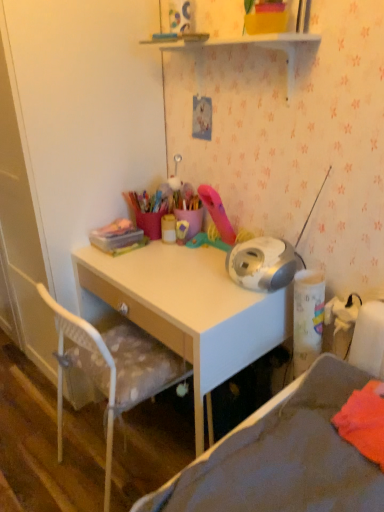
This screenshot has height=512, width=384. What do you see at coordinates (112, 369) in the screenshot?
I see `white mesh chair at lower left` at bounding box center [112, 369].

Where is `translucent plastic container at upper left, which appears as the 2th stationery when viewed from the right`? This screenshot has width=384, height=512. translucent plastic container at upper left, which appears as the 2th stationery when viewed from the right is located at coordinates pos(118,237).

What do you see at coordinates (282, 456) in the screenshot? I see `gray fabric bed at lower right` at bounding box center [282, 456].

Measure the distance between light wood desk at center and camera.

light wood desk at center is 1.15 meters away from camera.

Locate an element on the screen. The width and height of the screenshot is (384, 512). white mesh chair at lower left is located at coordinates (112, 369).

Does gray fabric bed at lower right appear on the right side of white mesh chair at lower left?

Yes.

Is gray fabric bed at lower right outside of white mesh chair at lower left?

Yes, gray fabric bed at lower right is outside of white mesh chair at lower left.

Where is `bed on the right of white mesh chair at lower left`? Image resolution: width=384 pixels, height=512 pixels. bed on the right of white mesh chair at lower left is located at coordinates (282, 456).

Consider the image. Who is bigger, gray fabric bed at lower right or white mesh chair at lower left?

white mesh chair at lower left.

Which is closer to the camera, (223, 42) or (70, 355)?

Point (223, 42)

Which object is closer to the camera, white glossy shelf at upper center or white mesh chair at lower left?

white glossy shelf at upper center is more forward.

Is white glossy shelf at upper center spatially inside white mesh chair at lower left, or outside of it?

white glossy shelf at upper center is outside white mesh chair at lower left.

Image resolution: width=384 pixels, height=512 pixels. Find the location of `shelf on the right of white mesh chair at lower left`. shelf on the right of white mesh chair at lower left is located at coordinates (242, 44).

Is matte yellow container at center, the 2th stationery from the left, wider than gray fabric bed at lower right?

No.

Which object is closer to the camera taking this photo, matte yellow container at center, positioned as the 1th stationery in right-to-left order, or gray fabric bed at lower right?

gray fabric bed at lower right is more forward.

Can you confirm if matte yellow container at center, the 2th stationery from the left, is positioned to the left of gray fabric bed at lower right?

Correct, you'll find matte yellow container at center, the 2th stationery from the left, to the left of gray fabric bed at lower right.

In terms of size, does matte yellow container at center, positioned as the 1th stationery in right-to-left order, appear bigger or smaller than gray fabric bed at lower right?

Considering their sizes, matte yellow container at center, positioned as the 1th stationery in right-to-left order, takes up less space than gray fabric bed at lower right.

Who is shorter, light wood desk at center or matte yellow container at center, positioned as the 1th stationery in right-to-left order?

Standing shorter between the two is matte yellow container at center, positioned as the 1th stationery in right-to-left order.

Is point (235, 337) closer to camera compared to point (164, 230)?

Yes, it is in front of point (164, 230).

Looking at this image, how many degrees apart are the facing directions of light wood desk at center and matte yellow container at center, positioned as the 1th stationery in right-to-left order?

0.000714 degrees separate the facing orientations of light wood desk at center and matte yellow container at center, positioned as the 1th stationery in right-to-left order.

From the image's perspective, is light wood desk at center located above matte yellow container at center, positioned as the 1th stationery in right-to-left order?

No.

Which is in front, point (165, 234) or point (292, 56)?

The point (292, 56) is closer.

Considering the relative positions of matte yellow container at center, the 2th stationery from the left, and white glossy shelf at upper center in the image provided, is matte yellow container at center, the 2th stationery from the left, to the right of white glossy shelf at upper center from the viewer's perspective?

No, matte yellow container at center, the 2th stationery from the left, is not to the right of white glossy shelf at upper center.

Based on the photo, which object is closer to the camera, matte yellow container at center, the 2th stationery from the left, or white glossy shelf at upper center?

white glossy shelf at upper center is closer to the camera.

Is the surface of matte yellow container at center, the 2th stationery from the left, in direct contact with white glossy shelf at upper center?

matte yellow container at center, the 2th stationery from the left, is not next to white glossy shelf at upper center, and they're not touching.

Considering the positions of point (148, 367) and point (378, 510), is point (148, 367) closer or farther from the camera than point (378, 510)?

Point (148, 367).

Is white mesh chair at lower left at the right side of gray fabric bed at lower right?

In fact, white mesh chair at lower left is to the left of gray fabric bed at lower right.

From a real-world perspective, is white mesh chair at lower left positioned above or below gray fabric bed at lower right?

In terms of real-world spatial position, white mesh chair at lower left is below gray fabric bed at lower right.

From the image's perspective, which one is positioned higher, white mesh chair at lower left or gray fabric bed at lower right?

gray fabric bed at lower right, from the image's perspective.

From a real-world perspective, is translucent plastic container at upper left, the 1th stationery when ordered from left to right, over white glossy shelf at upper center?

Incorrect, from a real-world perspective, translucent plastic container at upper left, the 1th stationery when ordered from left to right, is lower than white glossy shelf at upper center.

Relative to white glossy shelf at upper center, is translucent plastic container at upper left, the 1th stationery when ordered from left to right, in front or behind?

translucent plastic container at upper left, the 1th stationery when ordered from left to right, is behind white glossy shelf at upper center.

Is translucent plastic container at upper left, which appears as the 2th stationery when viewed from the right, next to white glossy shelf at upper center and touching it?

No, translucent plastic container at upper left, which appears as the 2th stationery when viewed from the right, is not in contact with white glossy shelf at upper center.

This screenshot has height=512, width=384. Find the location of `bed in front of the white mesh chair at lower left`. bed in front of the white mesh chair at lower left is located at coordinates (282, 456).

The height and width of the screenshot is (512, 384). Find the location of `shelf that appears above the white mesh chair at lower left (from the image's perspective)`. shelf that appears above the white mesh chair at lower left (from the image's perspective) is located at coordinates (242, 44).

Based on their spatial positions, is white mesh chair at lower left or gray fabric bed at lower right further from light wood desk at center?

gray fabric bed at lower right lies further to light wood desk at center than the other object.

When comparing their distances from gray fabric bed at lower right, does translucent plastic container at upper left, the 1th stationery when ordered from left to right, or light wood desk at center seem closer?

light wood desk at center is closer to gray fabric bed at lower right.

Which object lies further to the anchor point white glossy shelf at upper center, light wood desk at center or matte yellow container at center, positioned as the 1th stationery in right-to-left order?

The object further to white glossy shelf at upper center is light wood desk at center.

In the scene shown: Considering their positions, is translucent plastic container at upper left, the 1th stationery when ordered from left to right, positioned further to light wood desk at center than white glossy shelf at upper center?

white glossy shelf at upper center lies further to light wood desk at center than the other object.

In the scene shown: Estimate the real-world distances between objects in this image. Which object is closer to light wood desk at center, translucent plastic container at upper left, which appears as the 2th stationery when viewed from the right, or matte yellow container at center, positioned as the 1th stationery in right-to-left order?

translucent plastic container at upper left, which appears as the 2th stationery when viewed from the right, lies closer to light wood desk at center than the other object.

Looking at the image, which one is located further to light wood desk at center, matte yellow container at center, positioned as the 1th stationery in right-to-left order, or white mesh chair at lower left?

matte yellow container at center, positioned as the 1th stationery in right-to-left order, is further to light wood desk at center.

Based on the photo, which object lies further to the anchor point matte yellow container at center, positioned as the 1th stationery in right-to-left order, white mesh chair at lower left or light wood desk at center?

white mesh chair at lower left.

Estimate the real-world distances between objects in this image. Which object is further from white glossy shelf at upper center, translucent plastic container at upper left, the 1th stationery when ordered from left to right, or matte yellow container at center, positioned as the 1th stationery in right-to-left order?

Among the two, translucent plastic container at upper left, the 1th stationery when ordered from left to right, is located further to white glossy shelf at upper center.

Locate an element on the screen. desk between gray fabric bed at lower right and matte yellow container at center, the 2th stationery from the left, in the front-back direction is located at coordinates (189, 310).

Where is `desk between white mesh chair at lower left and gray fabric bed at lower right in the horizontal direction`? The image size is (384, 512). desk between white mesh chair at lower left and gray fabric bed at lower right in the horizontal direction is located at coordinates (189, 310).

At what (x,y) coordinates should I click in order to perform the action: click on chair positioned between gray fabric bed at lower right and translucent plastic container at upper left, the 1th stationery when ordered from left to right, from near to far. Please return your answer as a coordinate pair (x, y). Image resolution: width=384 pixels, height=512 pixels. Looking at the image, I should click on (112, 369).

Image resolution: width=384 pixels, height=512 pixels. In order to click on chair between gray fabric bed at lower right and matte yellow container at center, the 2th stationery from the left, along the z-axis in this screenshot , I will do `click(112, 369)`.